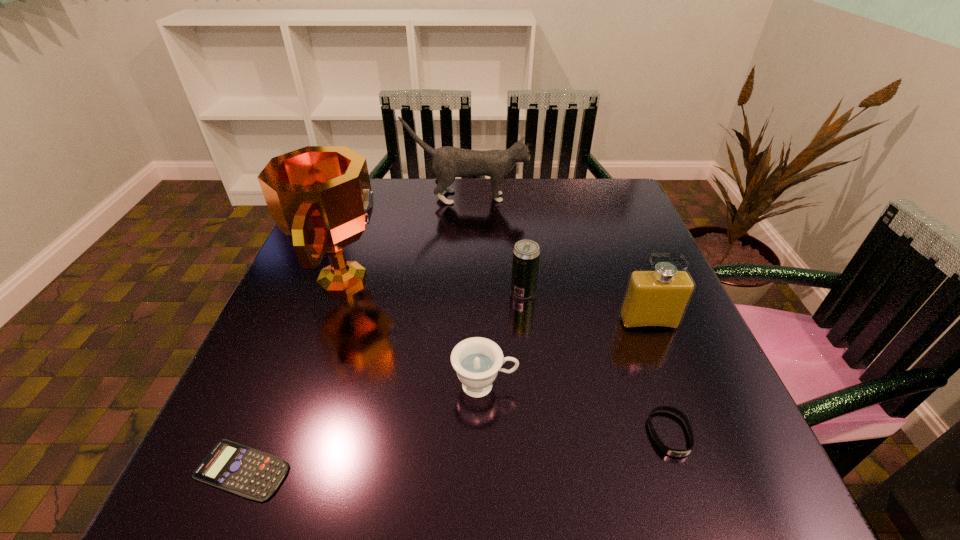
The width and height of the screenshot is (960, 540). I want to click on unoccupied area between the award and the teacup, so click(x=415, y=332).

Identify the location of free space between the third shortest object and the wristband. Image resolution: width=960 pixels, height=540 pixels. (577, 409).

Locate an element on the screen. vacant point located between the cat and the third tallest object is located at coordinates (558, 260).

The width and height of the screenshot is (960, 540). What are the coordinates of `blank region between the shortest object and the award` in the screenshot? It's located at (294, 374).

At what (x,y) coordinates should I click in order to perform the action: click on free space that is in between the fifth farthest object and the cat. Please return your answer as a coordinate pair (x, y). This screenshot has height=540, width=960. Looking at the image, I should click on 476,292.

This screenshot has width=960, height=540. In order to click on free space between the teacup and the second tallest object in this screenshot , I will do `click(476, 292)`.

At what (x,y) coordinates should I click in order to perform the action: click on free space between the award and the calculator. Please return your answer as a coordinate pair (x, y). The height and width of the screenshot is (540, 960). Looking at the image, I should click on (294, 374).

At what (x,y) coordinates should I click in order to perform the action: click on free point between the wristband and the award. Please return your answer as a coordinate pair (x, y). This screenshot has width=960, height=540. Looking at the image, I should click on (507, 356).

Identify which object is the sixth closest to the perfume. Please provide its 2D coordinates. Your answer should be formatted as a tuple, i.e. [(x, y)], where the tuple contains the x and y coordinates of a point satisfying the conditions above.

[(247, 472)]

Image resolution: width=960 pixels, height=540 pixels. Find the location of `object that is the sixth nearest to the award`. object that is the sixth nearest to the award is located at coordinates (665, 449).